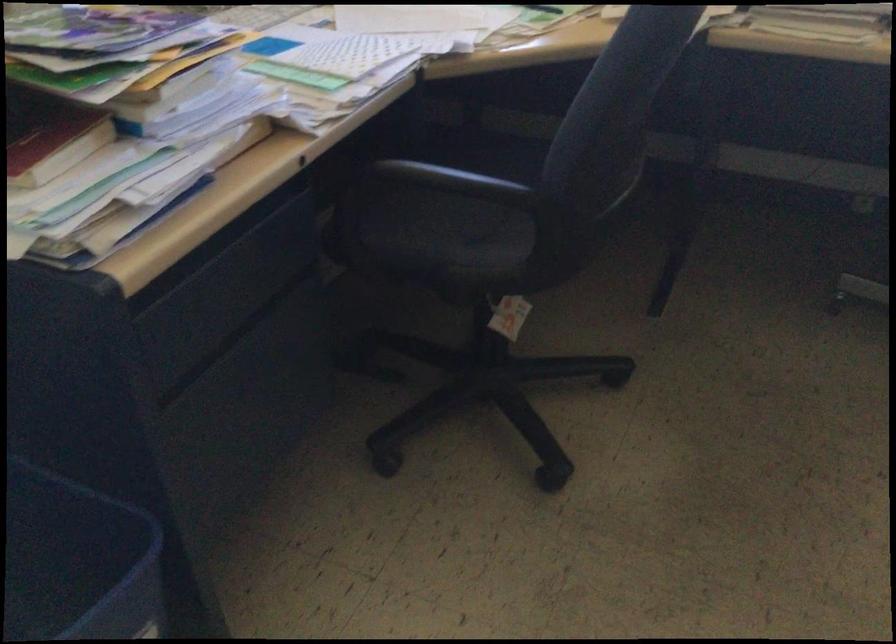
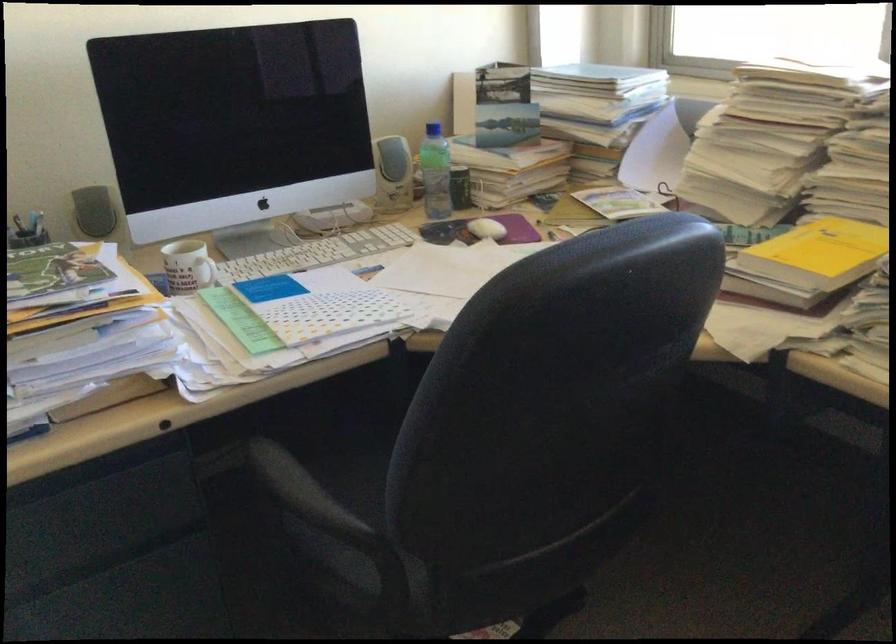
Question: Based on the continuous images, in which direction is the camera rotating? Reply with the corresponding letter.

Choices:
 (A) Left
 (B) Right
 (C) Up
 (D) Down

Answer: (A)